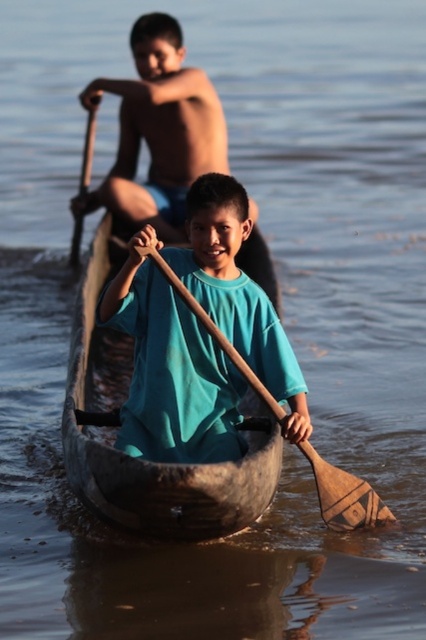
Question: Does brown wooden boat at center have a lesser width compared to wooden paddle at center?

Choices:
 (A) no
 (B) yes

Answer: (A)

Question: Is wooden paddle at center positioned at the back of wooden paddle at upper left?

Choices:
 (A) yes
 (B) no

Answer: (B)

Question: Which object is the closest to the wooden paddle at upper left?

Choices:
 (A) brown wooden boat at center
 (B) wooden paddle at center

Answer: (A)

Question: Which object is positioned farthest from the wooden paddle at center?

Choices:
 (A) brown wooden boat at center
 (B) wooden paddle at upper left

Answer: (B)

Question: Does wooden paddle at center have a lesser width compared to wooden paddle at upper left?

Choices:
 (A) no
 (B) yes

Answer: (B)

Question: Which object appears farthest from the camera in this image?

Choices:
 (A) wooden paddle at center
 (B) brown wooden boat at center
 (C) wooden paddle at upper left

Answer: (C)